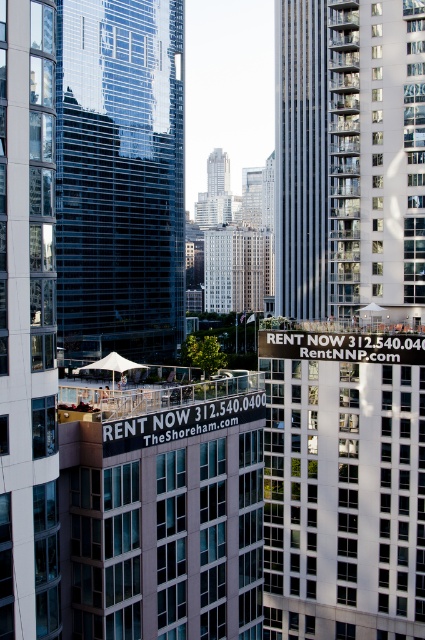
You are a drone operator tasked with flying a drone between the white glass building at right and the smooth gray skyscraper at center. The drone has a maximum flight distance of 120 feet. Can the drone safely fly between these two buildings without exceeding its range?

The white glass building at right is 132.32 feet away from the smooth gray skyscraper at center. Since the drone can only fly up to 120 feet, it cannot safely fly between them without exceeding its range.

You are standing at point (376,157) in the image. What do you see in front of you?

You see the white glass building at right in front of you at point (376,157).

You are a drone operator planning to fly a drone from the transparent glass building at center to the smooth gray skyscraper at center. Based on their positions, will the drone have a clear line of sight between these two buildings?

The transparent glass building at center is in front of the smooth gray skyscraper at center, so the drone will not have a clear line of sight between them because the transparent glass building is blocking the path.